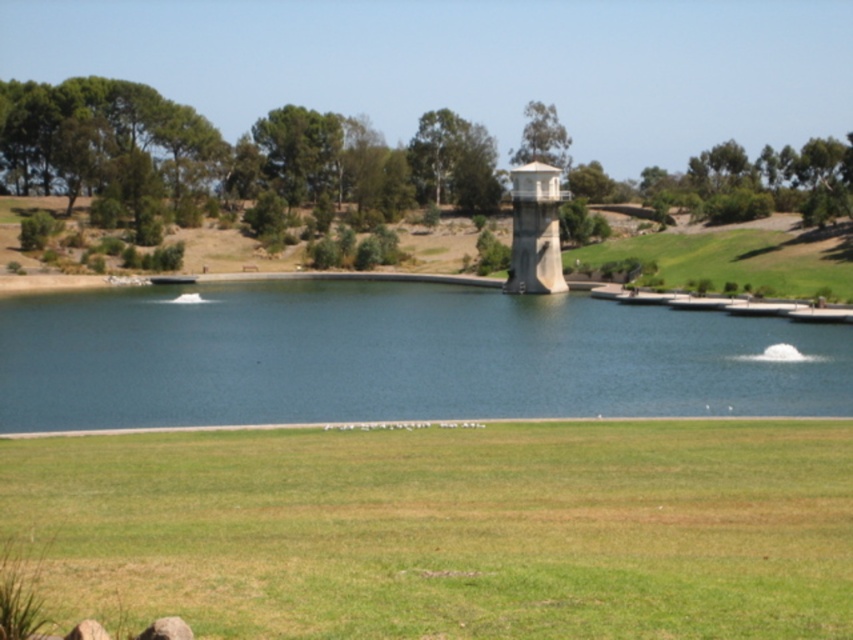
You are standing at the bottom of the image and want to reach the blue smooth water at center. Which direction should you move in to get there?

You should move towards the center of the image to reach the blue smooth water at center, as it is located at point coordinates of (396, 356).

You are a landscape architect designing a new pathway that needs to pass between the blue smooth water at center and the white concrete water tower at center. Knowing that the pathway must be at least 2 meters wide to accommodate foot traffic, can the existing space between them support this requirement?

The blue smooth water at center is wider than the white concrete water tower at center. Since the pathway requires a minimum of 2 meters, the existing space between them can accommodate the pathway as long as the narrower side meets or exceeds 2 meters. However, without exact measurements, we can only confirm the water is wider, but the actual width needs verification.